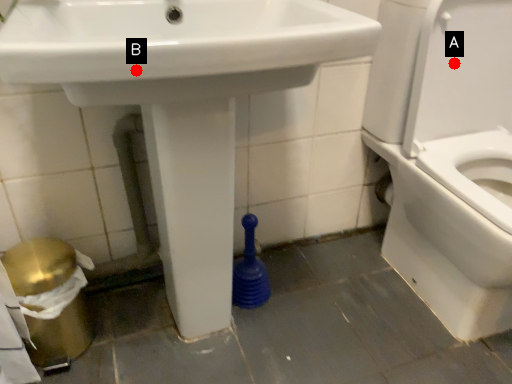
Question: Two points are circled on the image, labeled by A and B beside each circle. Which point is farther from the camera taking this photo?

Choices:
 (A) A is further
 (B) B is further

Answer: (A)